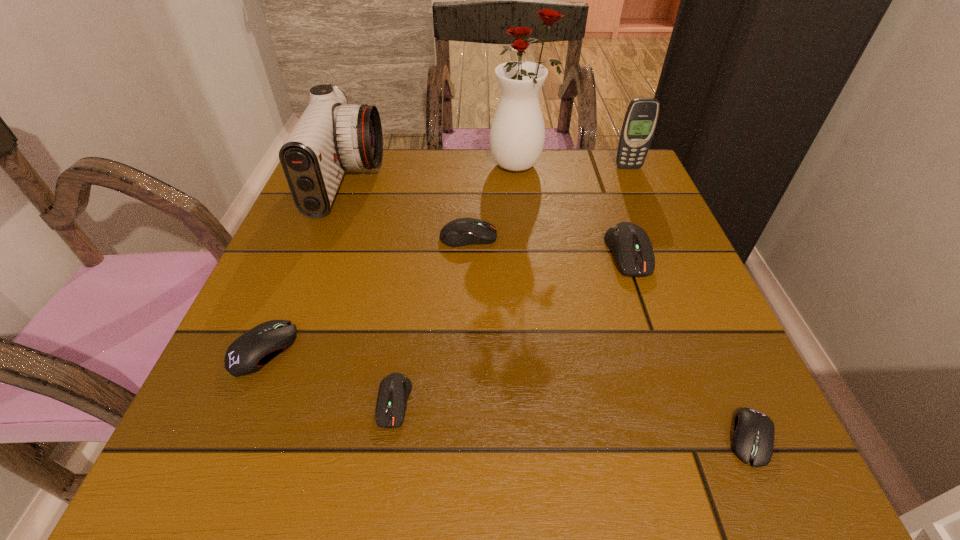
You are a GUI agent. You are given a task and a screenshot of the screen. Output one action in this format:
    pyautogui.click(x=<x>, y=<y>)
    Task: Click on the tallest object
    
    Given the screenshot: What is the action you would take?
    (517, 135)

Locate an element on the screen. red vase is located at coordinates (517, 135).

Image resolution: width=960 pixels, height=540 pixels. In order to click on camcorder in this screenshot , I will do `click(331, 136)`.

Where is `gray cellular telephone`? gray cellular telephone is located at coordinates (641, 117).

Where is `the tallest computer equipment`? the tallest computer equipment is located at coordinates 629,243.

The image size is (960, 540). Find the location of `the second computer equipment from right to left`. the second computer equipment from right to left is located at coordinates (629, 243).

Where is `the second biggest dark computer equipment`? This screenshot has width=960, height=540. the second biggest dark computer equipment is located at coordinates (460, 232).

Image resolution: width=960 pixels, height=540 pixels. What are the coordinates of `the second dark computer equipment from left to right` in the screenshot? It's located at (460, 232).

Identify the location of the farther black computer equipment. (249, 353).

You are a GUI agent. You are given a task and a screenshot of the screen. Output one action in this format:
    pyautogui.click(x=<x>, y=<y>)
    Task: Click on the left black computer equipment
    
    Given the screenshot: What is the action you would take?
    pyautogui.click(x=249, y=353)